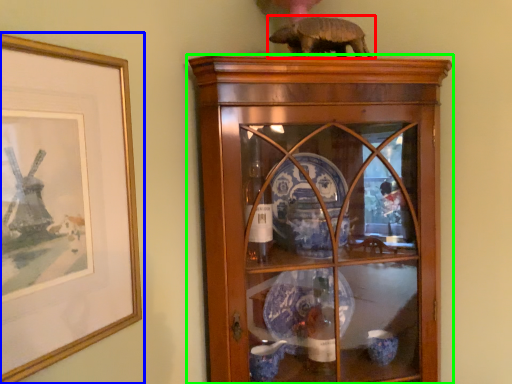
Question: Which object is the closest to the animal (highlighted by a red box)? Choose among these: picture frame (highlighted by a blue box) or shelf (highlighted by a green box).

Choices:
 (A) picture frame
 (B) shelf

Answer: (B)